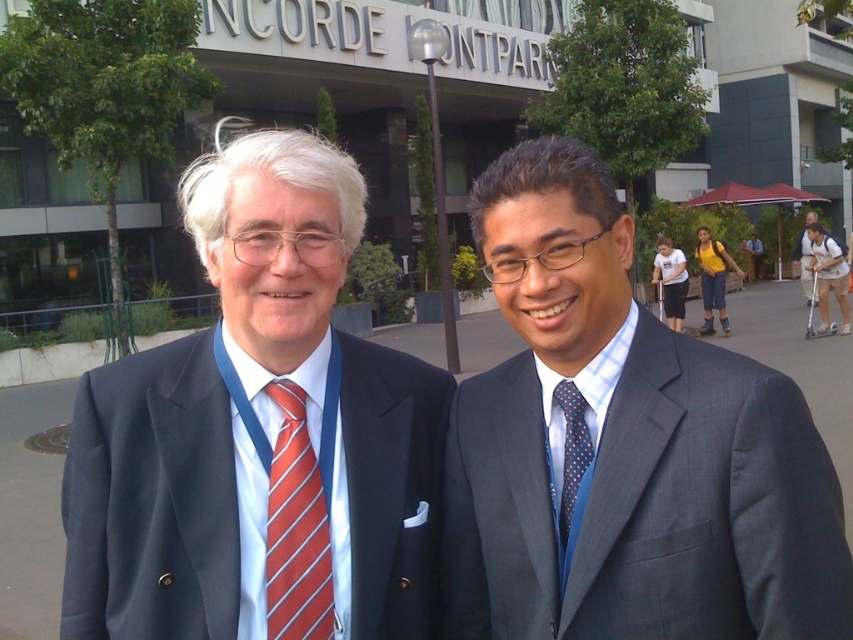
Is blue dotted tie at center smaller than white cotton shirt at right?

Yes.

Is point (561, 477) closer to camera compared to point (798, 237)?

Yes.

Where is `blue dotted tie at center`? The image size is (853, 640). blue dotted tie at center is located at coordinates (572, 474).

Is point (341, 522) farther from viewer compared to point (277, 634)?

Yes, it is.

Which of these two, matte black suit at center or red striped tie at center, stands taller?

matte black suit at center

Measure the distance between point (85, 477) and camera.

A distance of 1.70 meters exists between point (85, 477) and camera.

You are a GUI agent. You are given a task and a screenshot of the screen. Output one action in this format:
    pyautogui.click(x=<x>, y=<y>)
    Task: Click on the matte black suit at center
    
    Given the screenshot: What is the action you would take?
    pyautogui.click(x=258, y=435)

Between red striped tie at center and white cotton shirt at right, which one is positioned higher?

white cotton shirt at right

Which of these two, red striped tie at center or white cotton shirt at right, stands shorter?

Standing shorter between the two is red striped tie at center.

The height and width of the screenshot is (640, 853). Identify the location of red striped tie at center. (296, 529).